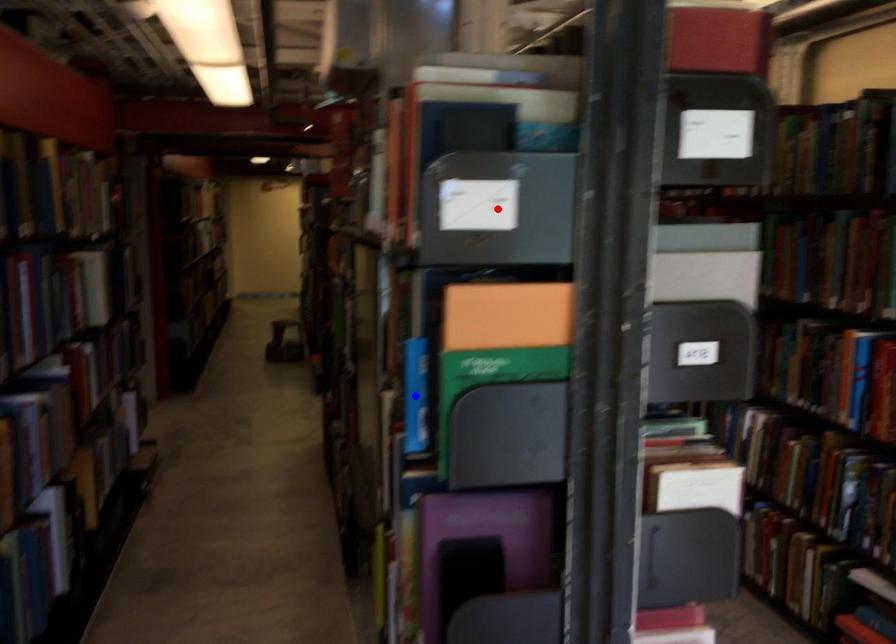
Question: In the image, two points are highlighted. Which point is nearer to the camera? Reply with the corresponding letter.

Choices:
 (A) blue point
 (B) red point

Answer: (B)